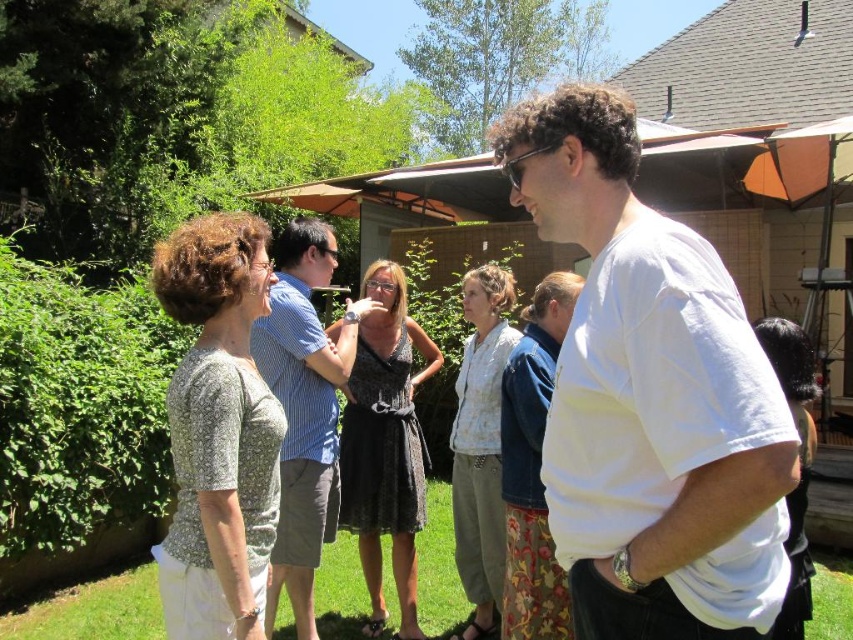
You are standing in the backyard and want to move from point A to point B. Point A is at coordinates point (328, 502) and point B is at point (805, 612). Which point is closer to you?

Point A at coordinates point (328, 502) is closer to you because it is further to the viewer than point B at point (805, 612).

You are organizing a photoshoot and need to ensure that the light gray textured blouse at center and the matte black dress at center are both visible in the final image. Given their current positions, which clothing item is covering part of the other?

The light gray textured blouse at center is positioned over the matte black dress at center, so it is covering part of it.